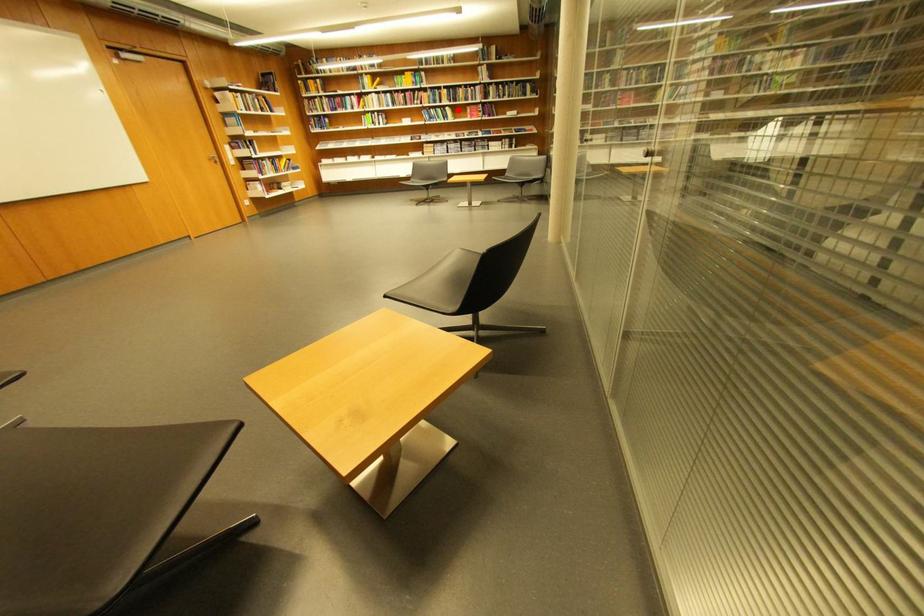
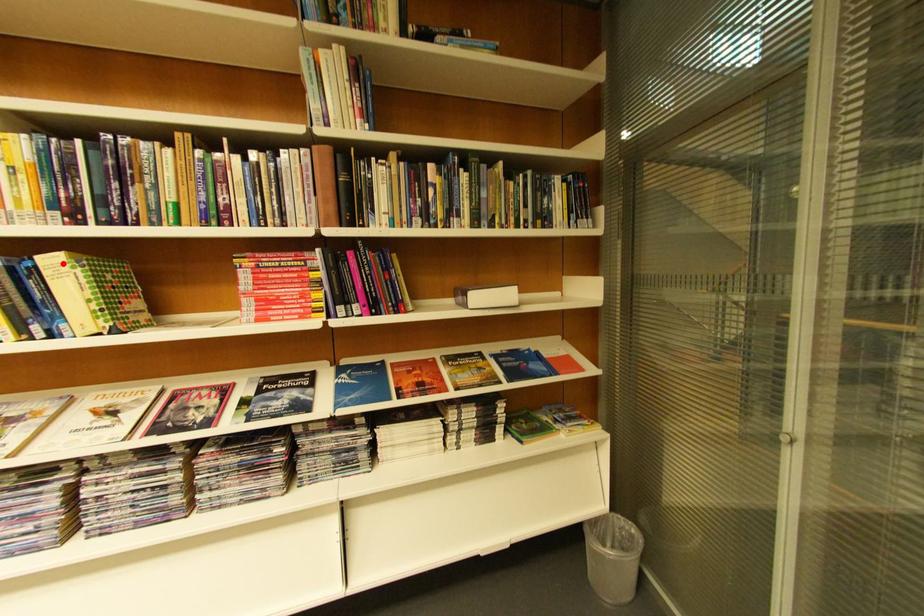
I am providing you with two images of the same scene from different viewpoints. A red point is marked on the first image and another point is marked on the second image. Does the point marked in image1 correspond to the same location as the one in image2?

Yes